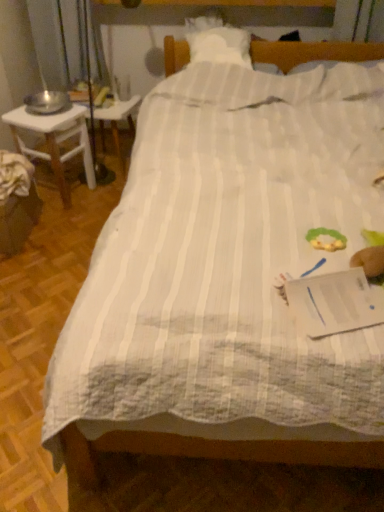
Question: Considering the relative positions of white plastic table at left and white wooden desk at left in the image provided, is white plastic table at left in front of white wooden desk at left?

Choices:
 (A) yes
 (B) no

Answer: (B)

Question: Would you consider white plastic table at left to be distant from white wooden desk at left?

Choices:
 (A) no
 (B) yes

Answer: (A)

Question: Is white plastic table at left beside white wooden desk at left?

Choices:
 (A) yes
 (B) no

Answer: (B)

Question: Can you confirm if white plastic table at left is thinner than white wooden desk at left?

Choices:
 (A) no
 (B) yes

Answer: (B)

Question: From a real-world perspective, is white plastic table at left beneath white wooden desk at left?

Choices:
 (A) yes
 (B) no

Answer: (A)

Question: Considering the relative sizes of white plastic table at left and white wooden desk at left in the image provided, is white plastic table at left taller than white wooden desk at left?

Choices:
 (A) no
 (B) yes

Answer: (A)

Question: Does white wooden desk at left have a greater width compared to white plastic table at left?

Choices:
 (A) yes
 (B) no

Answer: (A)

Question: Does white wooden desk at left lie behind white plastic table at left?

Choices:
 (A) yes
 (B) no

Answer: (B)

Question: Can you confirm if white wooden desk at left is smaller than white plastic table at left?

Choices:
 (A) yes
 (B) no

Answer: (B)

Question: Does white wooden desk at left have a lesser height compared to white plastic table at left?

Choices:
 (A) yes
 (B) no

Answer: (B)

Question: Would you say white wooden desk at left is outside white plastic table at left?

Choices:
 (A) no
 (B) yes

Answer: (B)

Question: Does white wooden desk at left appear on the left side of white plastic table at left?

Choices:
 (A) yes
 (B) no

Answer: (A)

Question: Considering the relative positions of white plastic table at left and white wooden desk at left in the image provided, is white plastic table at left to the left or to the right of white wooden desk at left?

Choices:
 (A) left
 (B) right

Answer: (B)